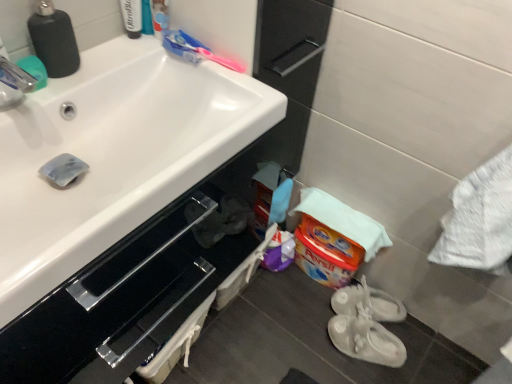
Where is `unoccupied area in front of white rubber shoes at lower right, positioned as the 1th footwear in back-to-front order`? The image size is (512, 384). unoccupied area in front of white rubber shoes at lower right, positioned as the 1th footwear in back-to-front order is located at coordinates (375, 370).